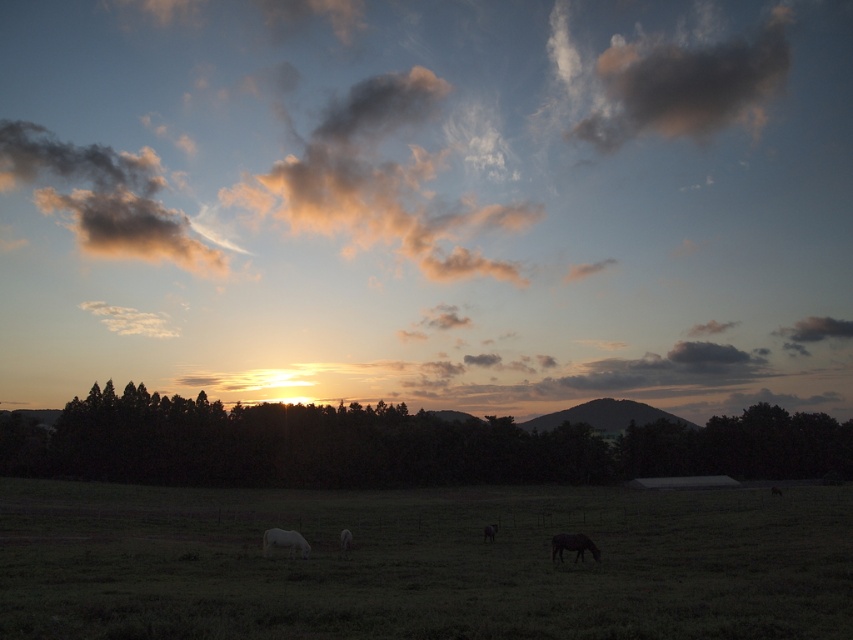
Question: Which point appears farthest from the camera in this image?

Choices:
 (A) (103, 420)
 (B) (305, 548)
 (C) (344, 545)
 (D) (695, 102)

Answer: (D)

Question: Among these points, which one is farthest from the camera?

Choices:
 (A) (692, 460)
 (B) (135, 246)
 (C) (590, 540)
 (D) (671, 48)

Answer: (D)

Question: Does dark green leafy trees at center lie in front of matte orange cloud at upper center?

Choices:
 (A) no
 (B) yes

Answer: (B)

Question: Is the position of matte orange cloud at upper center more distant than that of dark gray fluffy cloud at upper left?

Choices:
 (A) no
 (B) yes

Answer: (A)

Question: Does dark green leafy trees at center appear on the right side of dark gray cloud at upper center?

Choices:
 (A) yes
 (B) no

Answer: (B)

Question: Considering the real-world distances, which object is farthest from the dark gray fluffy cloud at upper left?

Choices:
 (A) white woolly sheep at lower left
 (B) dark green leafy trees at center
 (C) white matte horse at lower left
 (D) white matte horse at center

Answer: (A)